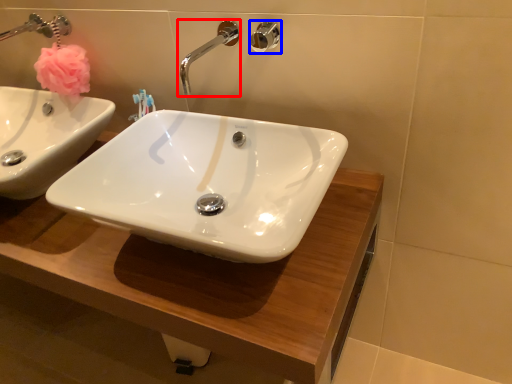
Question: Among these objects, which one is farthest to the camera, tap (highlighted by a red box) or shower (highlighted by a blue box)?

Choices:
 (A) tap
 (B) shower

Answer: (B)